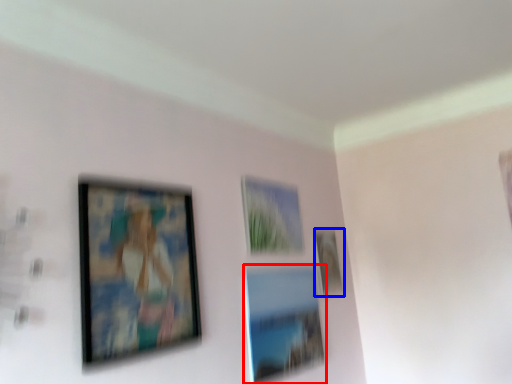
Question: Which object appears closest to the camera in this image, picture frame (highlighted by a red box) or picture frame (highlighted by a blue box)?

Choices:
 (A) picture frame
 (B) picture frame

Answer: (A)